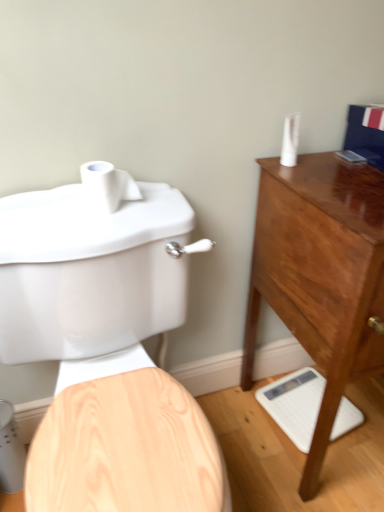
Identify the location of vacant region to the left of white matte toilet paper at upper left. (54, 211).